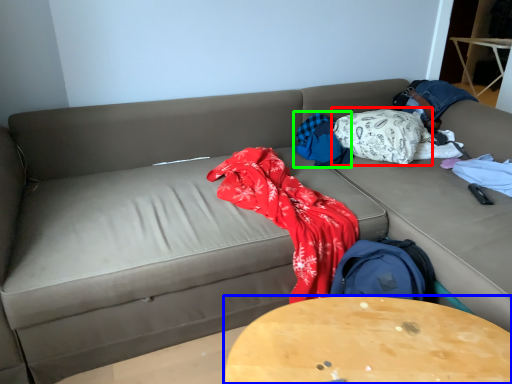
Question: Estimate the real-world distances between objects in this image. Which object is closer to blanket (highlighted by a red box), table (highlighted by a blue box) or blanket (highlighted by a green box)?

Choices:
 (A) table
 (B) blanket

Answer: (B)